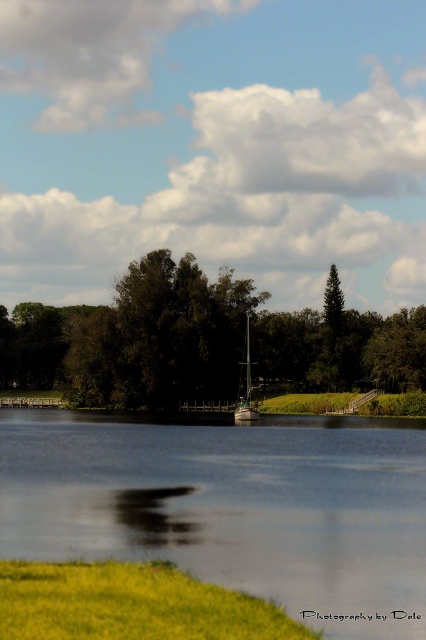
Question: Estimate the real-world distances between objects in this image. Which object is closer to the smooth water at center?

Choices:
 (A) green leafy tree at center
 (B) metallic silver sailboat at center

Answer: (B)

Question: Which point is closer to the camera?

Choices:
 (A) (229, 349)
 (B) (337, 429)
 (C) (247, 380)

Answer: (B)

Question: From the image, what is the correct spatial relationship of smooth water at center in relation to green leafy tree at center?

Choices:
 (A) above
 (B) below

Answer: (B)

Question: Can you confirm if smooth water at center is bigger than metallic silver sailboat at center?

Choices:
 (A) yes
 (B) no

Answer: (A)

Question: Which object is closer to the camera taking this photo?

Choices:
 (A) smooth water at center
 (B) metallic silver sailboat at center

Answer: (A)

Question: Does smooth water at center come in front of metallic silver sailboat at center?

Choices:
 (A) yes
 (B) no

Answer: (A)